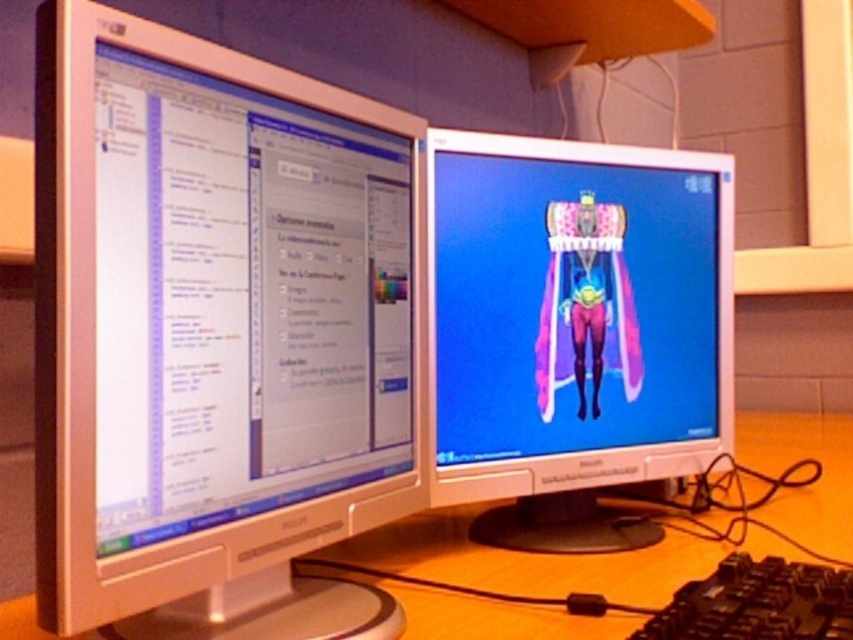
Question: Does matte white monitor at left have a smaller size compared to matte plastic monitor at center?

Choices:
 (A) no
 (B) yes

Answer: (B)

Question: Which point is farther from the camera taking this photo?

Choices:
 (A) (711, 588)
 (B) (218, 243)

Answer: (A)

Question: Is matte white monitor at left further to the viewer compared to matte plastic monitor at center?

Choices:
 (A) yes
 (B) no

Answer: (B)

Question: Among these objects, which one is nearest to the camera?

Choices:
 (A) matte plastic monitor at center
 (B) black plastic keyboard at lower right
 (C) wooden at center
 (D) matte white monitor at left

Answer: (D)

Question: Which point appears closest to the camera in this image?

Choices:
 (A) 416,120
 (B) 805,625
 (C) 718,435
 (D) 838,452

Answer: (B)

Question: Is wooden at center to the right of black plastic keyboard at lower right from the viewer's perspective?

Choices:
 (A) no
 (B) yes

Answer: (B)